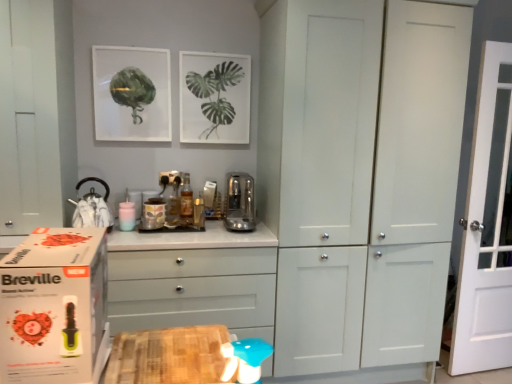
Question: From the image's perspective, is matte ceramic jar at center, which is the 2th appliance in right-to-left order, above or below matte glass picture frame at upper left, the second picture frame when ordered from right to left?

Choices:
 (A) below
 (B) above

Answer: (A)

Question: In the image, is matte ceramic jar at center, acting as the second appliance starting from the left, positioned in front of or behind matte glass picture frame at upper left, the 1th picture frame positioned from the left?

Choices:
 (A) behind
 (B) front

Answer: (B)

Question: Which is nearer to the white matte cabinet at left?

Choices:
 (A) matte white picture frame at upper center, positioned as the first picture frame in right-to-left order
 (B) white wooden door at right
 (C) white glossy chest of drawers at center
 (D) blue plastic toy at lower center
 (E) matte glass picture frame at upper left, the 1th picture frame positioned from the left

Answer: (E)

Question: Estimate the real-world distances between objects in this image. Which object is closer to the matte ceramic jar at center, which is the 2th appliance in right-to-left order?

Choices:
 (A) white cardboard box at left
 (B) satin silver toaster at center, the first appliance in the right-to-left sequence
 (C) blue plastic toy at lower center
 (D) shiny silver kettle at left, which appears as the 1th appliance when viewed from the left
 (E) white matte cabinet at left

Answer: (D)